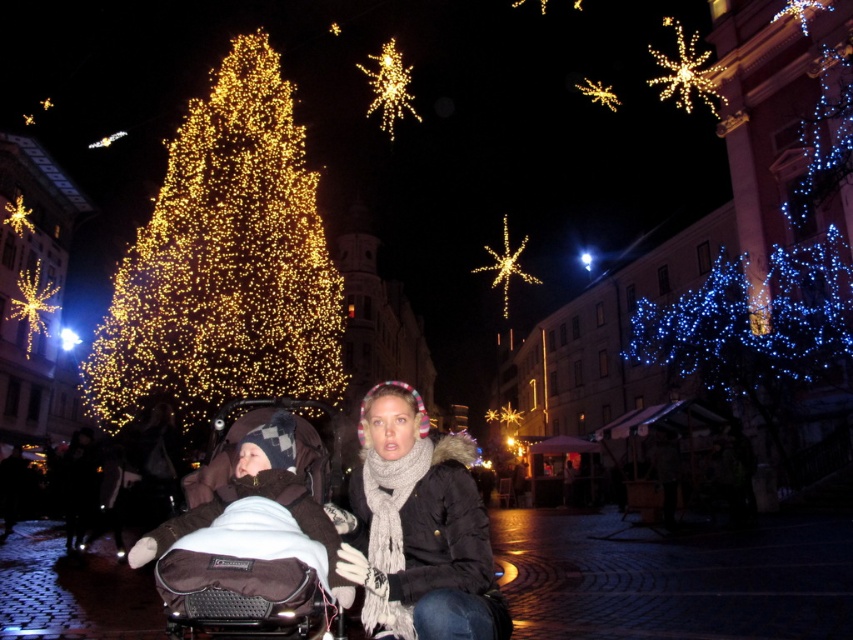
Question: Is black fur-trimmed coat at center bigger than iridescent metallic starburst at upper center?

Choices:
 (A) no
 (B) yes

Answer: (A)

Question: Considering the real-world distances, which object is farthest from the gold string lights at center?

Choices:
 (A) black fur-trimmed coat at center
 (B) illuminated gold lights at left
 (C) blue glittering lights at upper right
 (D) iridescent metallic starburst at upper center

Answer: (A)

Question: Considering the real-world distances, which object is farthest from the brown fabric baby carriage at lower left?

Choices:
 (A) black fur-trimmed coat at center
 (B) illuminated gold lights at left
 (C) illuminated star at upper right
 (D) blue glittering lights at upper right

Answer: (C)

Question: Does blue glittering lights at upper right lie in front of brown fabric baby carriage at lower left?

Choices:
 (A) yes
 (B) no

Answer: (B)

Question: Does illuminated gold lights at left appear on the left side of illuminated star at upper right?

Choices:
 (A) no
 (B) yes

Answer: (B)

Question: Which is nearer to the iridescent metallic starburst at upper center?

Choices:
 (A) blue glittering lights at upper right
 (B) brown fabric baby carriage at lower left
 (C) black fur-trimmed coat at center
 (D) gold string lights at center

Answer: (D)